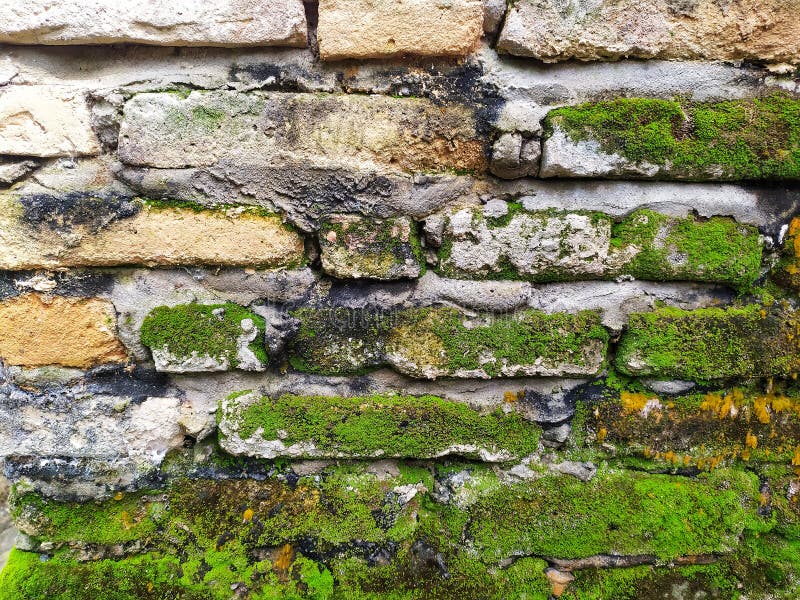
Locate an element on the screen. direct light is located at coordinates (2, 16).